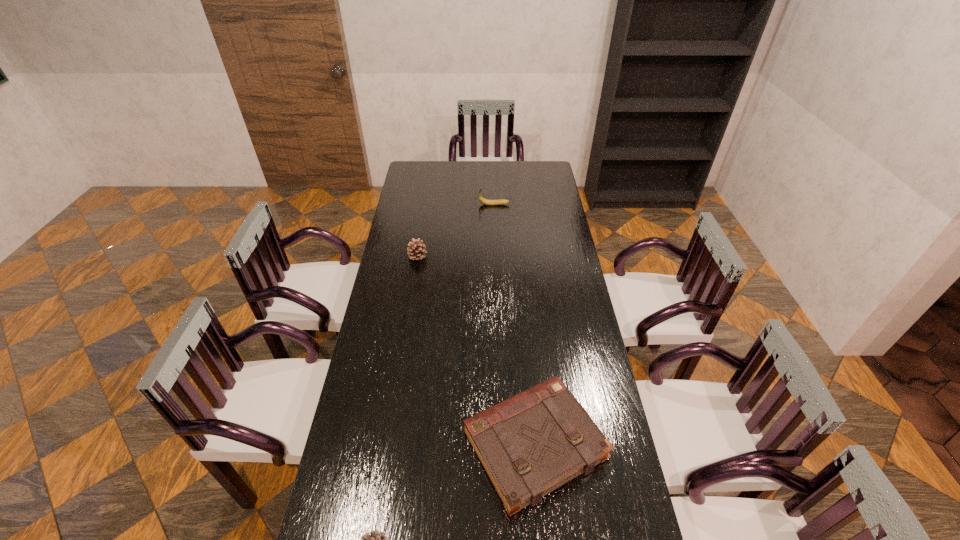
Where is `free space between the third farthest object and the farther pinecone`? This screenshot has width=960, height=540. free space between the third farthest object and the farther pinecone is located at coordinates (476, 350).

Identify which object is located as the third nearest to the nearest object. Please provide its 2D coordinates. Your answer should be formatted as a tuple, i.e. [(x, y)], where the tuple contains the x and y coordinates of a point satisfying the conditions above.

[(484, 201)]

Image resolution: width=960 pixels, height=540 pixels. In order to click on object that is the third closest to the banana in this screenshot , I will do `click(375, 539)`.

At what (x,y) coordinates should I click in order to perform the action: click on vacant space that satisfies the following two spatial constraints: 1. at the stem of the third farthest object; 2. on the right side of the farthest object. Please return your answer as a coordinate pair (x, y). Image resolution: width=960 pixels, height=540 pixels. Looking at the image, I should click on (504, 445).

You are a GUI agent. You are given a task and a screenshot of the screen. Output one action in this format:
    pyautogui.click(x=<x>, y=<y>)
    Task: Click on the free spot that satisfies the following two spatial constraints: 1. on the back side of the hardback book; 2. at the stem of the farthest object
    
    Given the screenshot: What is the action you would take?
    pyautogui.click(x=512, y=205)

Identify the location of free space that satisfies the following two spatial constraints: 1. at the stem of the hardback book; 2. on the right side of the farthest object. (504, 445).

You are a GUI agent. You are given a task and a screenshot of the screen. Output one action in this format:
    pyautogui.click(x=<x>, y=<y>)
    Task: Click on the vacant space that satisfies the following two spatial constraints: 1. at the stem of the hardback book; 2. on the right side of the farthest object
    
    Given the screenshot: What is the action you would take?
    pyautogui.click(x=504, y=445)

This screenshot has width=960, height=540. In order to click on free location that satisfies the following two spatial constraints: 1. on the front side of the second farthest object; 2. on the right side of the second nearest object in this screenshot , I will do click(x=388, y=445).

Find the location of a particular element. vacant space that satisfies the following two spatial constraints: 1. at the stem of the banana; 2. on the left side of the second nearest object is located at coordinates (504, 445).